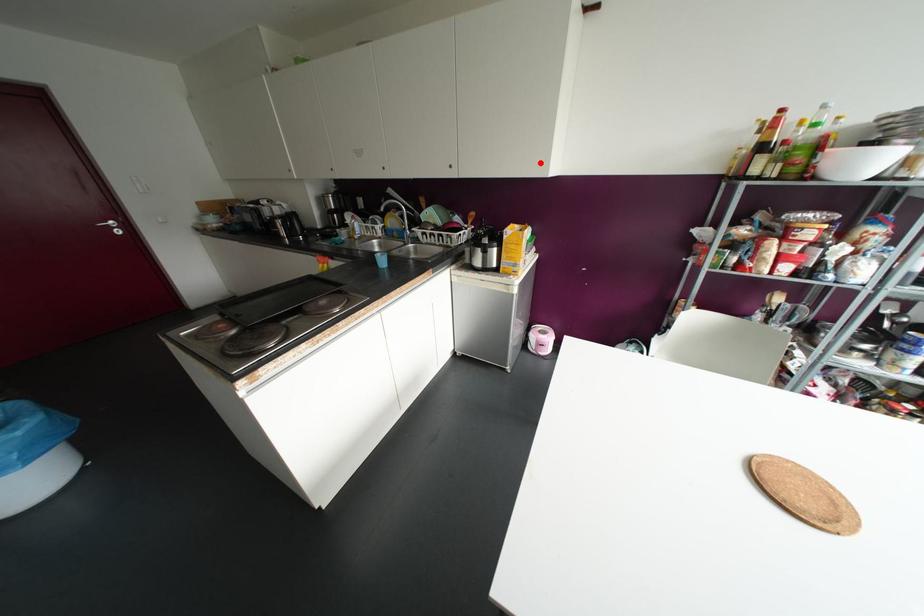
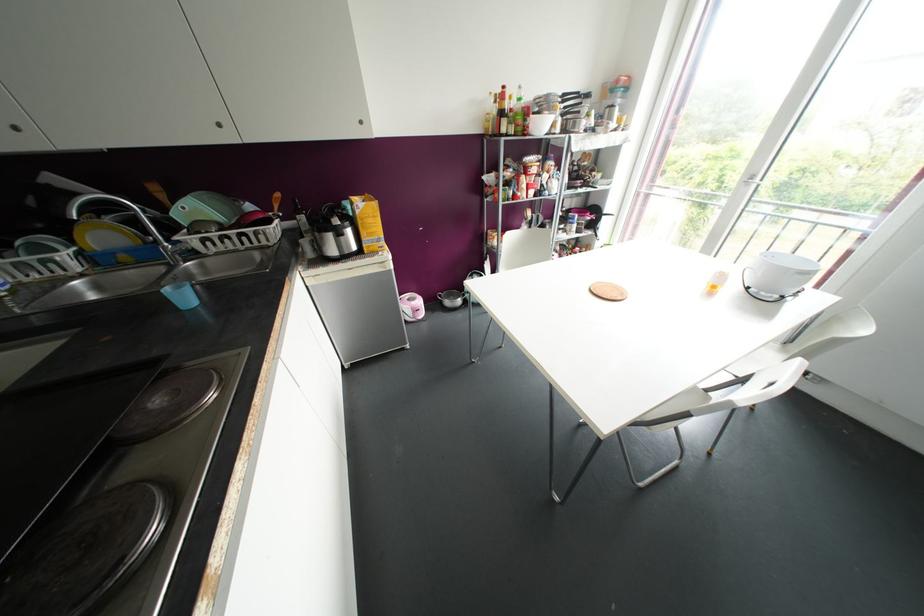
Find the pixel in the second image that matches the highlighted location in the first image.

(360, 122)